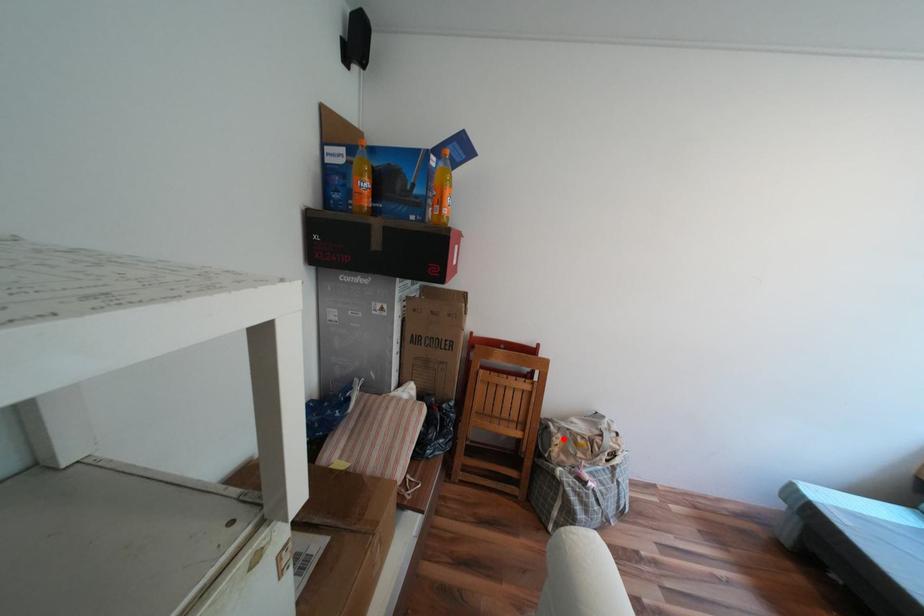
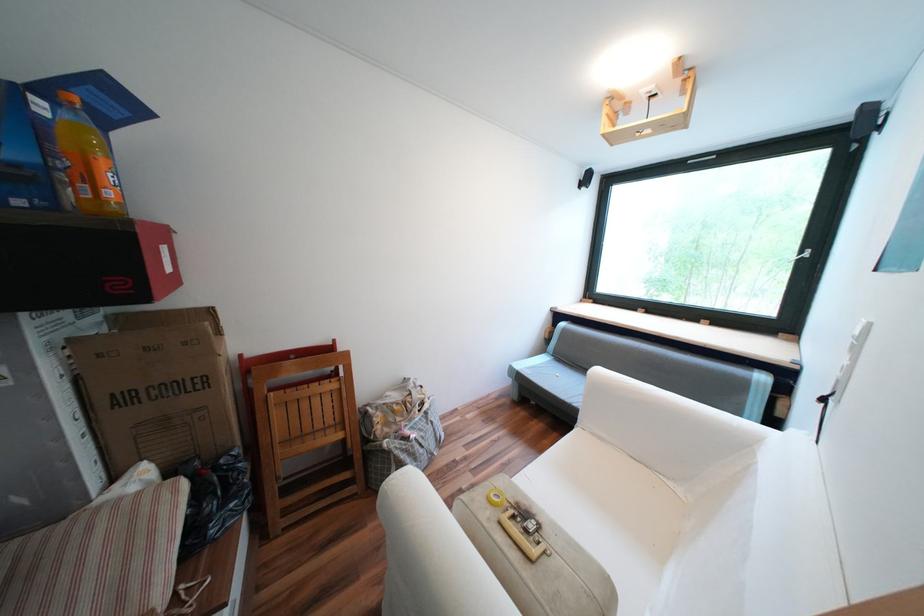
Find the pixel in the second image that matches the highlighted location in the first image.

(383, 419)